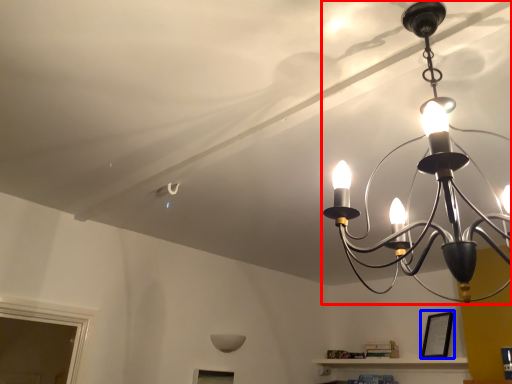
Question: Which of the following is the farthest to the observer, lamp (highlighted by a red box) or picture frame (highlighted by a blue box)?

Choices:
 (A) lamp
 (B) picture frame

Answer: (B)